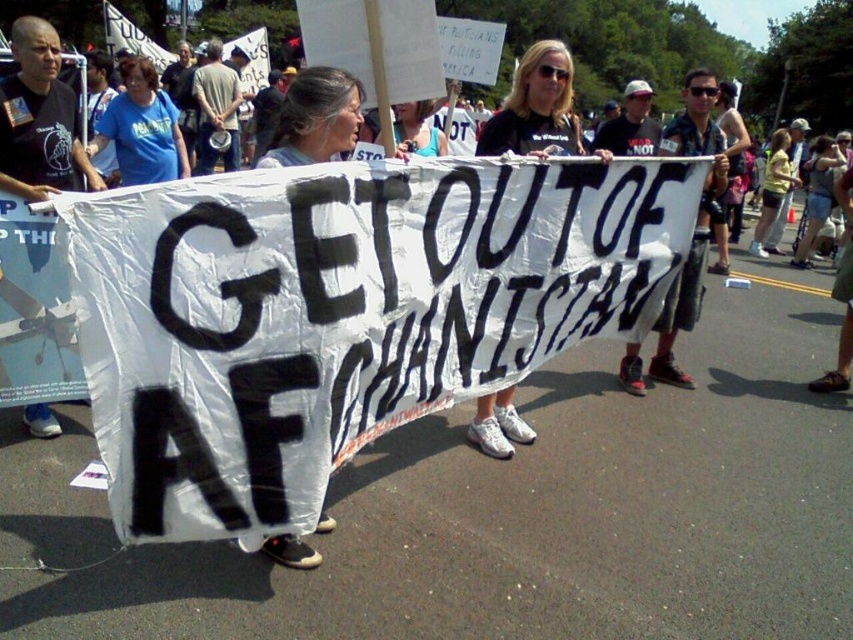
Does black t-shirt at center appear on the left side of blue t-shirt at left?

Incorrect, black t-shirt at center is not on the left side of blue t-shirt at left.

Locate an element on the screen. black t-shirt at center is located at coordinates 537,108.

Does gray fabric shirt at center appear under matte white banner at center?

Correct, gray fabric shirt at center is located below matte white banner at center.

Is gray fabric shirt at center bigger than matte white banner at center?

Incorrect, gray fabric shirt at center is not larger than matte white banner at center.

Is point (312, 554) behind point (421, 113)?

That is False.

Find the location of `gray fabric shirt at center`. gray fabric shirt at center is located at coordinates (315, 118).

Does blue t-shirt at left have a smaller size compared to matte white banner at center?

Actually, blue t-shirt at left might be larger than matte white banner at center.

Between point (186, 156) and point (405, 125), which one is positioned in front?

Point (405, 125) is in front.

Is point (160, 113) less distant than point (437, 140)?

That is False.

Identify the location of blue t-shirt at left. The width and height of the screenshot is (853, 640). (141, 129).